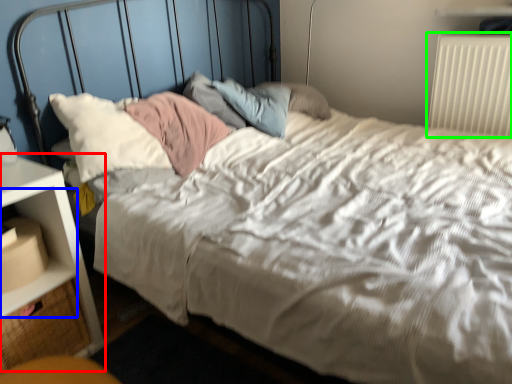
Question: Which object is the farthest from nightstand (highlighted by a red box)? Choose among these: shelf (highlighted by a blue box) or radiator (highlighted by a green box).

Choices:
 (A) shelf
 (B) radiator

Answer: (B)